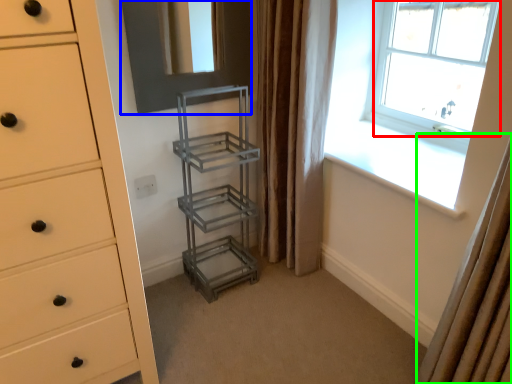
Question: Considering the real-world distances, which object is farthest from window (highlighted by a red box)? screen door (highlighted by a blue box) or curtain (highlighted by a green box)?

Choices:
 (A) screen door
 (B) curtain

Answer: (B)